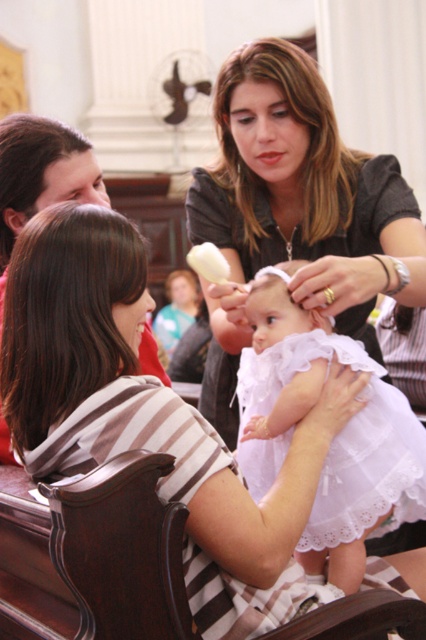
You are an interior designer assessing the layout of this church scene. You notice the striped fabric shirt at lower left and the brown smooth hair at upper center. Which object is positioned closer to you?

The striped fabric shirt at lower left is closer to the viewer than the brown smooth hair at upper center.

Based on the scene description, where is the striped fabric shirt at lower left located in the image?

The striped fabric shirt at lower left is located at the 2D coordinates point (152, 417).

You are an interior designer assessing the layout of this church scene. You notice the brown smooth hair at upper center and the brown striped shirt at lower left. Which object is positioned higher in the image?

The brown smooth hair at upper center is taller than the brown striped shirt at lower left, so it is positioned higher in the image.